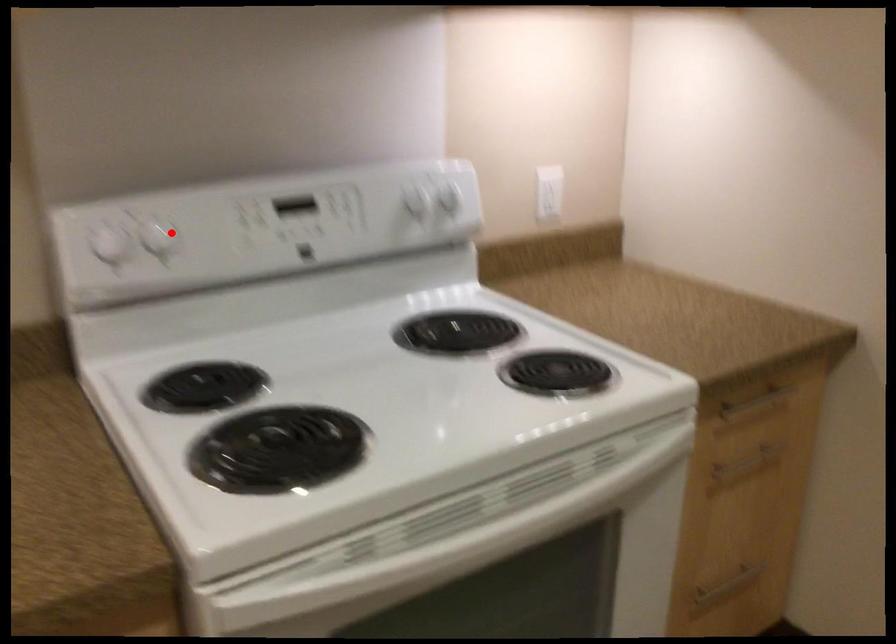
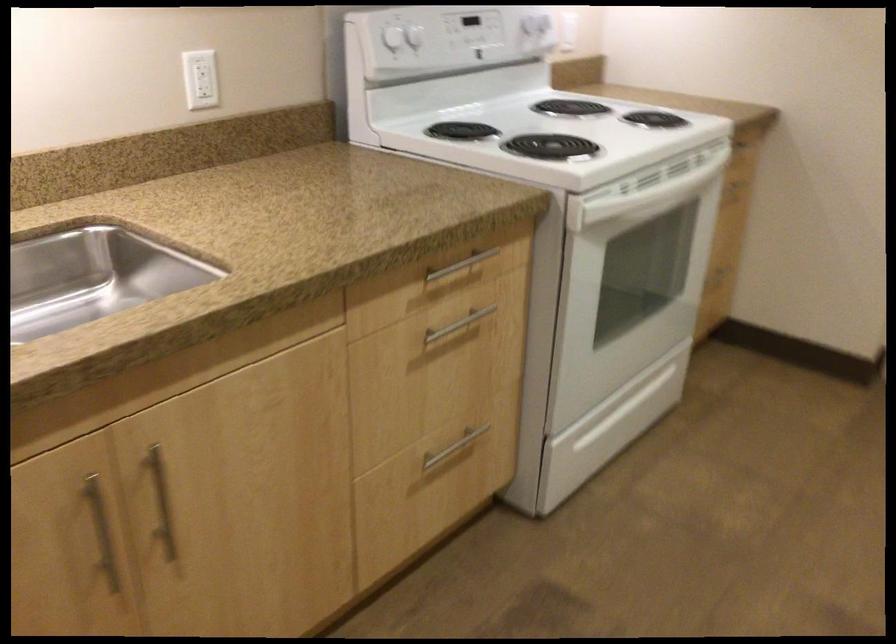
Question: I am providing you with two images of the same scene from different viewpoints. Image1 has a red point marked. In image2, the corresponding 3D location appears at what relative position? Reply with the corresponding letter.

Choices:
 (A) Closer
 (B) Farther

Answer: (B)